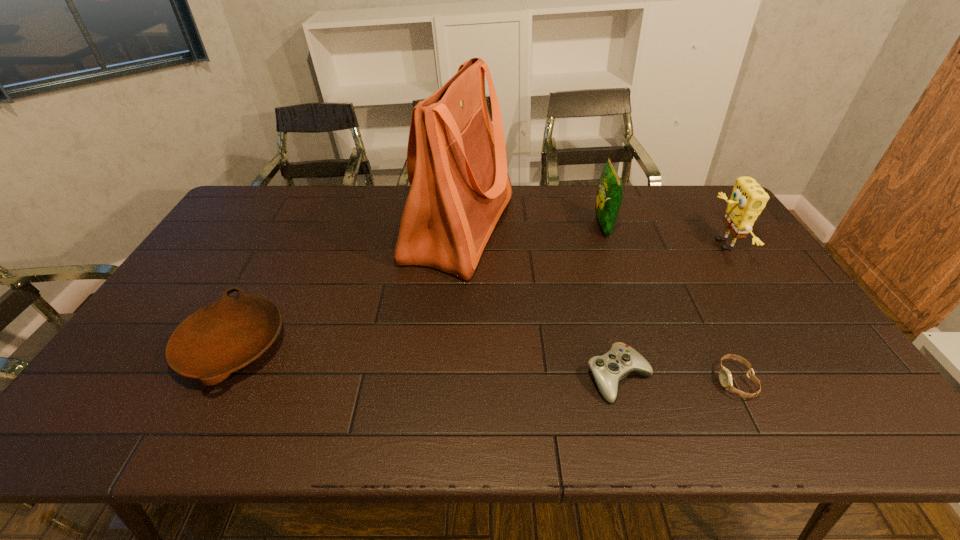
Image resolution: width=960 pixels, height=540 pixels. I want to click on the second object from left to right, so click(456, 159).

The width and height of the screenshot is (960, 540). What are the coordinates of `shopping bag` in the screenshot? It's located at (456, 159).

Image resolution: width=960 pixels, height=540 pixels. I want to click on sponge, so click(x=748, y=199).

The height and width of the screenshot is (540, 960). Identify the location of crisp (potato chip). (610, 190).

I want to click on plate, so click(x=220, y=338).

Find the location of a particular element. Image resolution: width=960 pixels, height=540 pixels. control is located at coordinates (608, 369).

Find the location of a particular element. Image resolution: width=960 pixels, height=540 pixels. watch is located at coordinates (725, 377).

Locate an element on the screen. This screenshot has width=960, height=540. the shortest object is located at coordinates [x=725, y=377].

You are a GUI agent. You are given a task and a screenshot of the screen. Output one action in this format:
    pyautogui.click(x=<x>, y=<y>)
    Task: Click on the vacant space located on the right of the fifth object from right to left
    This screenshot has height=540, width=960.
    Given the screenshot: What is the action you would take?
    pyautogui.click(x=621, y=228)

The image size is (960, 540). Identify the location of vacant space located 0.150m on the face of the sponge. [663, 245].